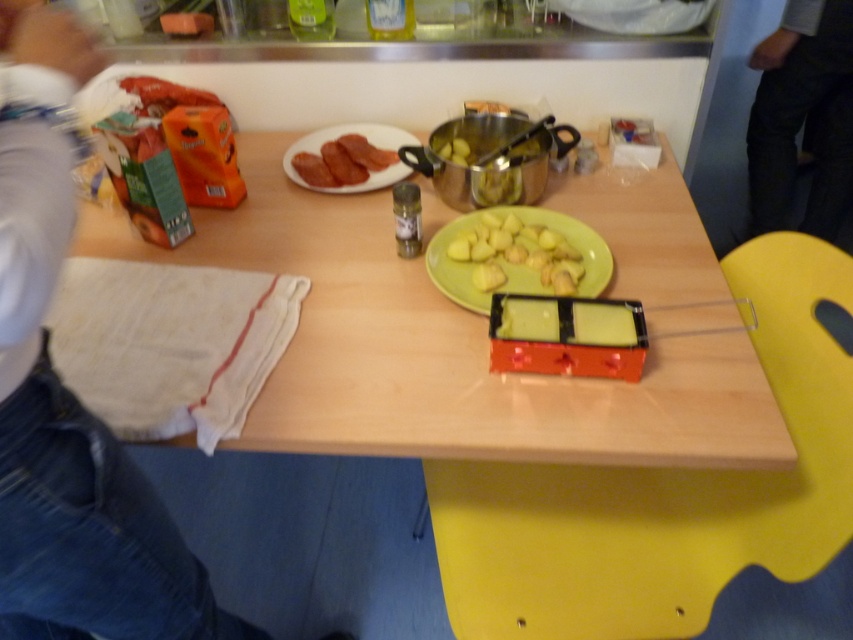
You are arranging food on a wooden table at center. You want to place a new dish on the yellow matte potatoes at center. Is there enough space?

The wooden table at center is positioned over yellow matte potatoes at center, meaning the potatoes are placed directly on the table. Since the table is the surface, there should be space to place the new dish on the yellow matte potatoes at center as long as there is room around them.

You are standing in the kitchen and want to place a new dish on the wooden table at center. Where exactly should you place it?

The wooden table at center is located at point (447,349), so you should place the new dish at that coordinate on the wooden table at center.